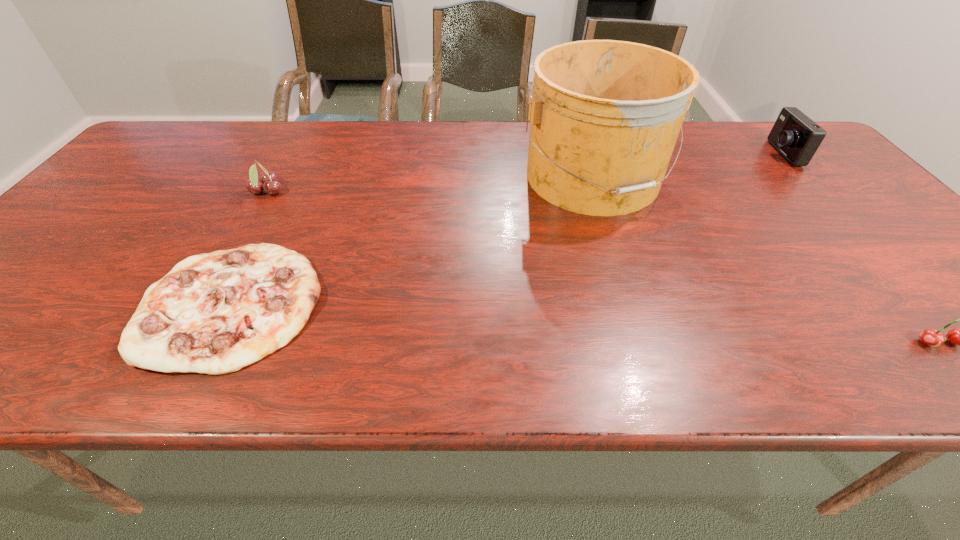
Image resolution: width=960 pixels, height=540 pixels. Identify the location of the tallest object. (605, 115).

This screenshot has height=540, width=960. In order to click on the third object from left to right in this screenshot , I will do `click(605, 115)`.

I want to click on the second tallest object, so click(x=797, y=137).

At what (x,y) coordinates should I click in order to perform the action: click on the farther cherry. Please return your answer as a coordinate pair (x, y). Image resolution: width=960 pixels, height=540 pixels. Looking at the image, I should click on (268, 182).

Find the location of a particular element. The width and height of the screenshot is (960, 540). the shortest object is located at coordinates (214, 313).

I want to click on free space located 0.360m on the right of the tallest object, so click(x=800, y=178).

This screenshot has height=540, width=960. What are the coordinates of `free space located on the front-facing side of the camera` in the screenshot? It's located at (718, 153).

Image resolution: width=960 pixels, height=540 pixels. Identify the location of vacant space located on the front-facing side of the camera. (690, 153).

You are a GUI agent. You are given a task and a screenshot of the screen. Output one action in this format:
    pyautogui.click(x=<x>, y=<y>)
    Task: Click on the vacant position located on the front-facing side of the camera
    This screenshot has width=960, height=540.
    Given the screenshot: What is the action you would take?
    pyautogui.click(x=721, y=153)

Image resolution: width=960 pixels, height=540 pixels. Find the location of `free location located 0.370m on the leaves of the left cherry`. free location located 0.370m on the leaves of the left cherry is located at coordinates (425, 192).